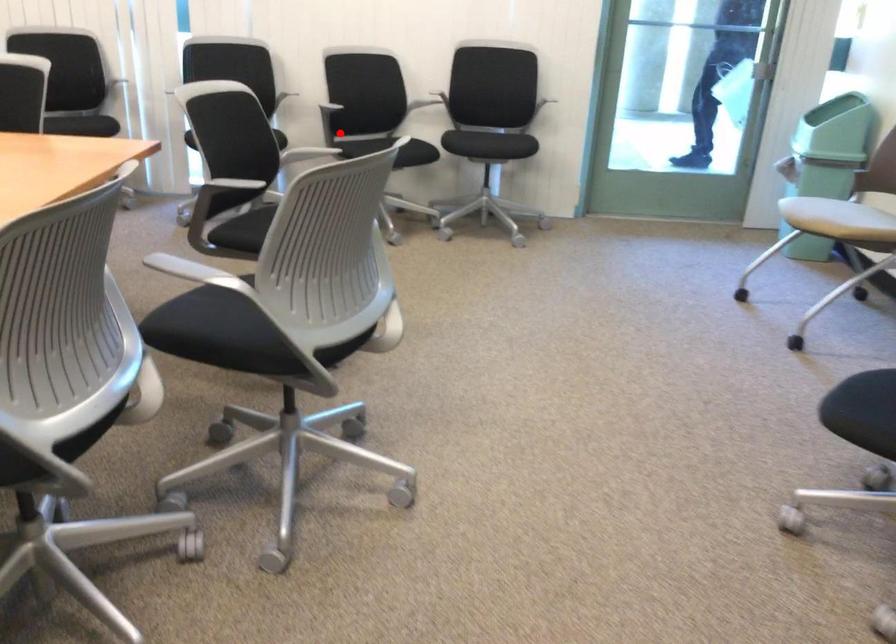
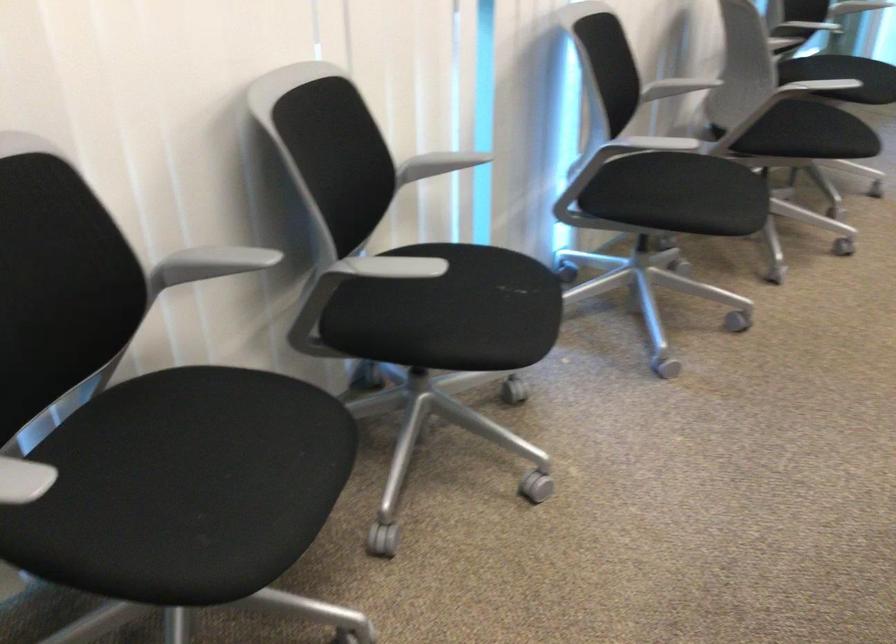
Question: I am providing you with two images of the same scene from different viewpoints. In image1, a red point is highlighted. Considering the same 3D point in image2, which of the following is correct?

Choices:
 (A) It is closer
 (B) It is farther

Answer: (A)